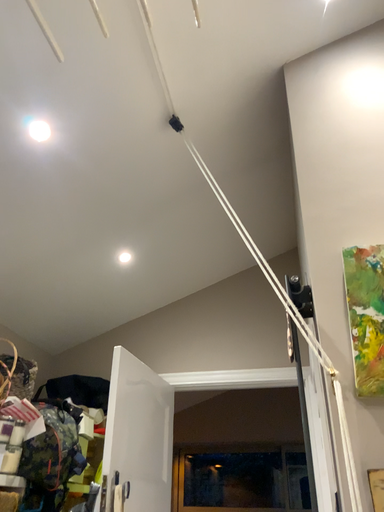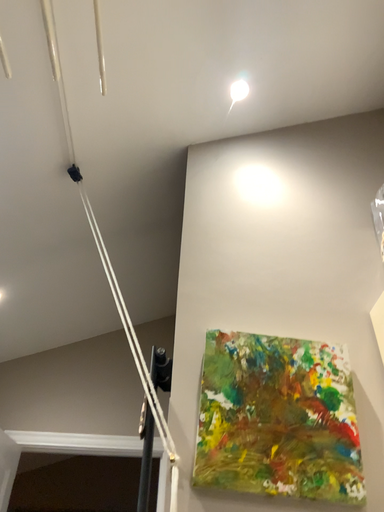
Question: How did the camera likely rotate when shooting the video?

Choices:
 (A) rotated left
 (B) rotated right

Answer: (B)